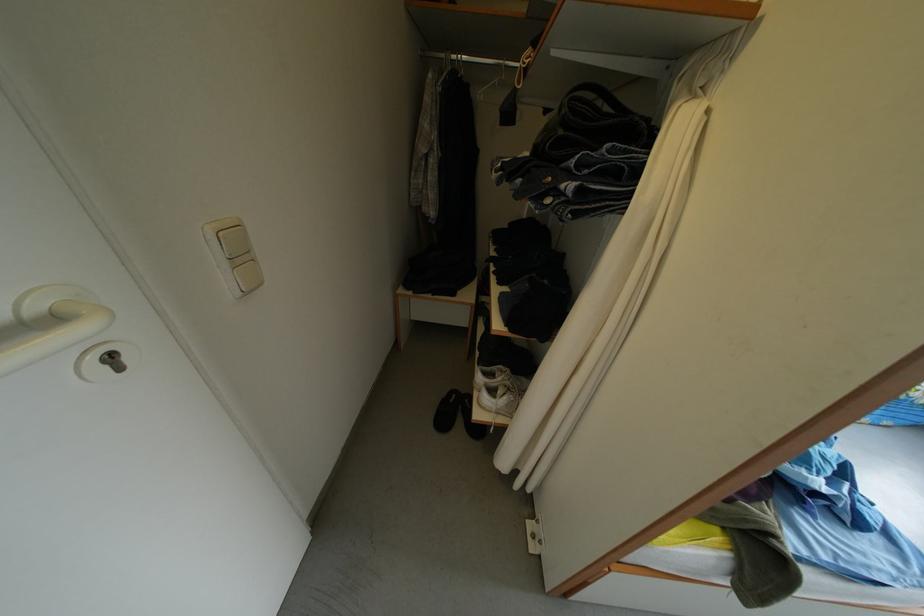
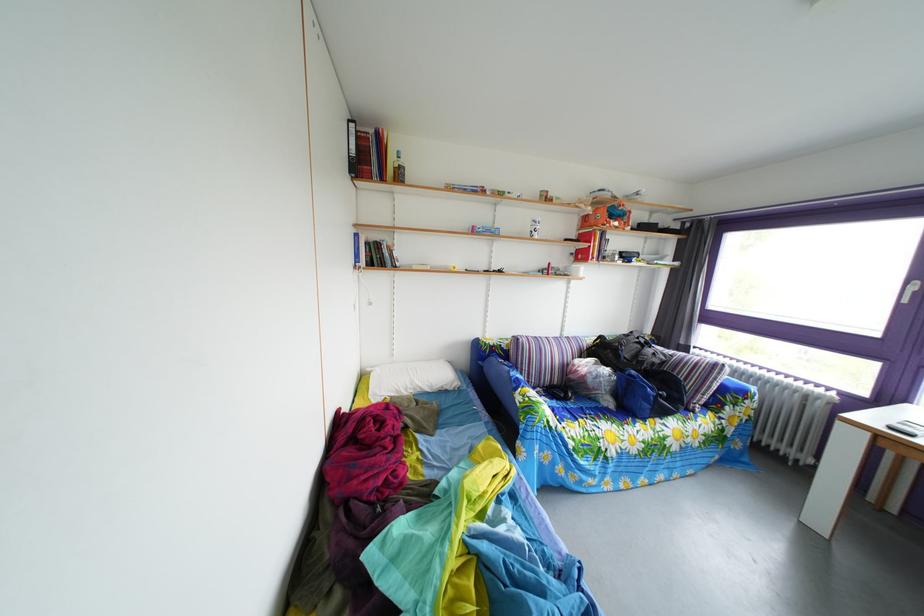
Based on the continuous images, in which direction is the camera rotating?

The camera rotated toward right-up.